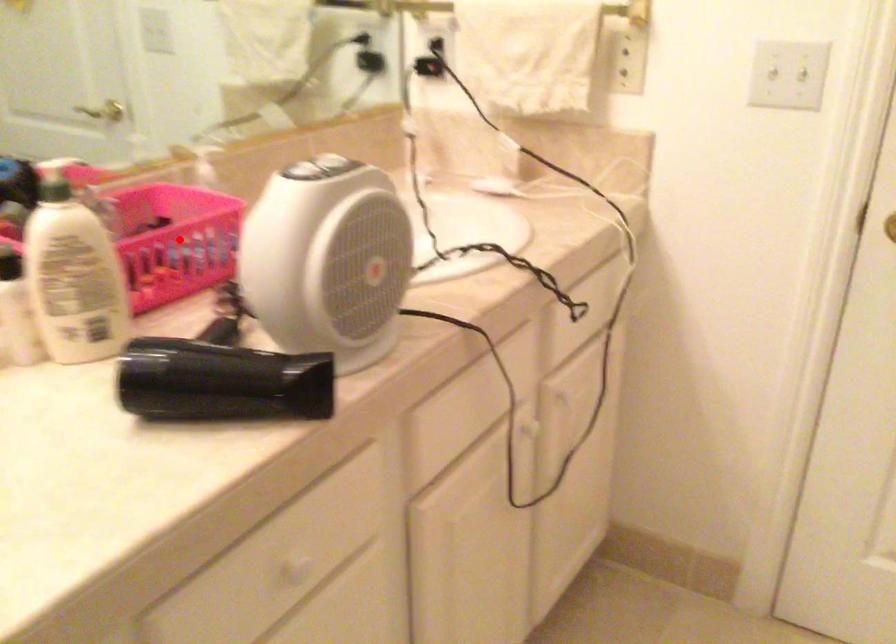
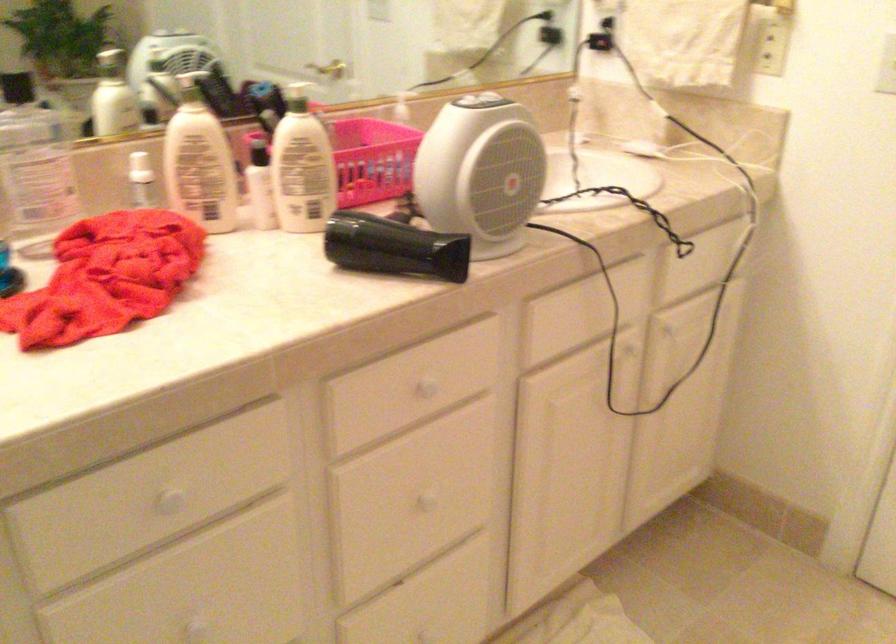
The point at the highlighted location is marked in the first image. Where is the corresponding point in the second image?

(367, 158)